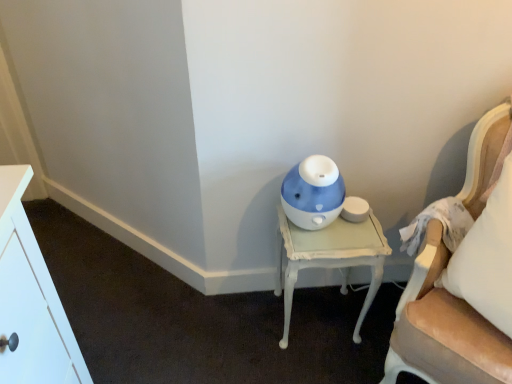
Question: Considering the positions of white painted wood nightstand at lower right and blue glossy humidifier at center in the image, is white painted wood nightstand at lower right bigger or smaller than blue glossy humidifier at center?

Choices:
 (A) small
 (B) big

Answer: (B)

Question: Looking at their shapes, would you say white painted wood nightstand at lower right is wider or thinner than blue glossy humidifier at center?

Choices:
 (A) wide
 (B) thin

Answer: (A)

Question: Estimate the real-world distances between objects in this image. Which object is farther from the blue glossy humidifier at center?

Choices:
 (A) white painted wood nightstand at lower right
 (B) velvet beige chair at right

Answer: (B)

Question: Which object is the closest to the white painted wood nightstand at lower right?

Choices:
 (A) velvet beige chair at right
 (B) blue glossy humidifier at center

Answer: (B)